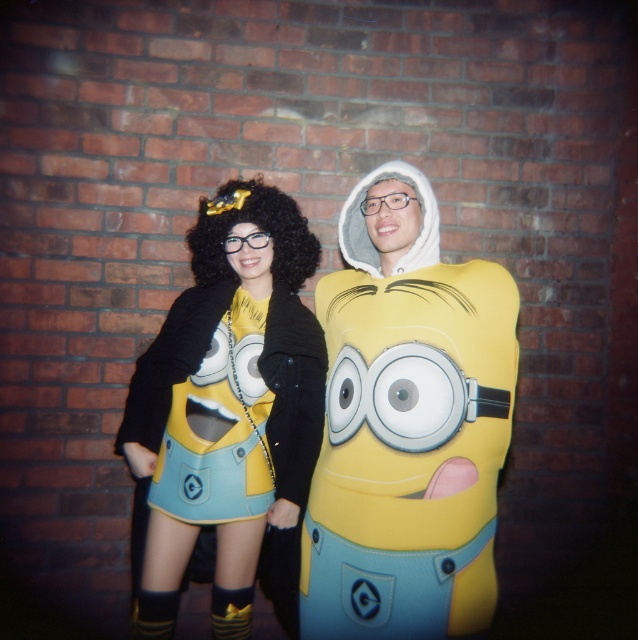
Question: Among these points, which one is nearest to the camera?

Choices:
 (A) (177, 321)
 (B) (447, 476)

Answer: (B)

Question: Is matte yellow costume at center above matte yellow dress at center?

Choices:
 (A) no
 (B) yes

Answer: (B)

Question: Does matte yellow costume at center have a smaller size compared to matte yellow dress at center?

Choices:
 (A) yes
 (B) no

Answer: (B)

Question: Which of the following is the farthest from the observer?

Choices:
 (A) (376, 237)
 (B) (131, 403)

Answer: (B)

Question: Among these objects, which one is nearest to the camera?

Choices:
 (A) matte yellow costume at center
 (B) matte yellow dress at center

Answer: (A)

Question: Is matte yellow costume at center wider than matte yellow dress at center?

Choices:
 (A) yes
 (B) no

Answer: (B)